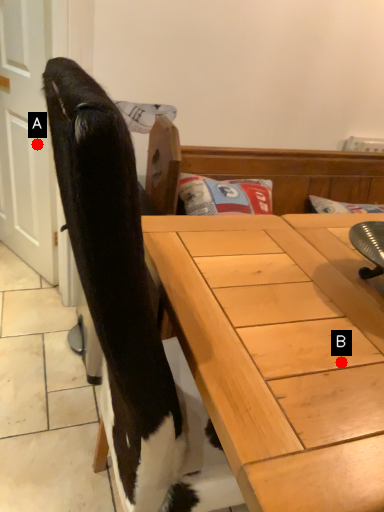
Question: Two points are circled on the image, labeled by A and B beside each circle. Which of the following is the closest to the observer?

Choices:
 (A) A is closer
 (B) B is closer

Answer: (B)